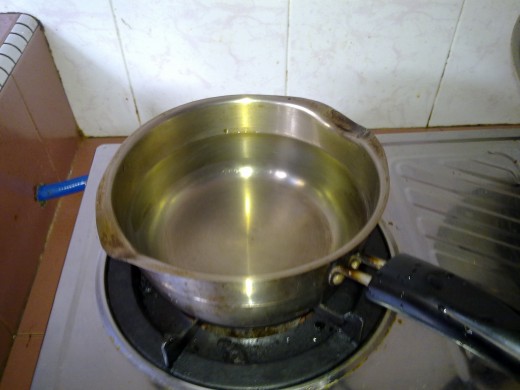
Locate an element on the screen. handle of pan is located at coordinates (448, 323).